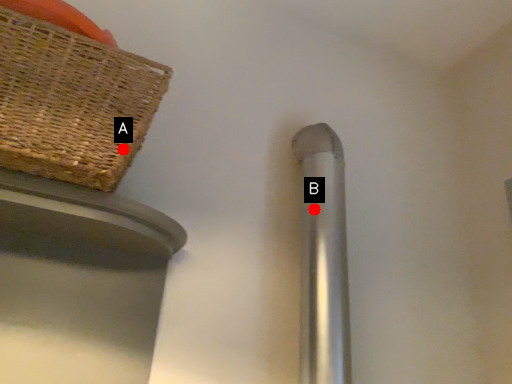
Question: Two points are circled on the image, labeled by A and B beside each circle. Which point is closer to the camera taking this photo?

Choices:
 (A) A is closer
 (B) B is closer

Answer: (A)